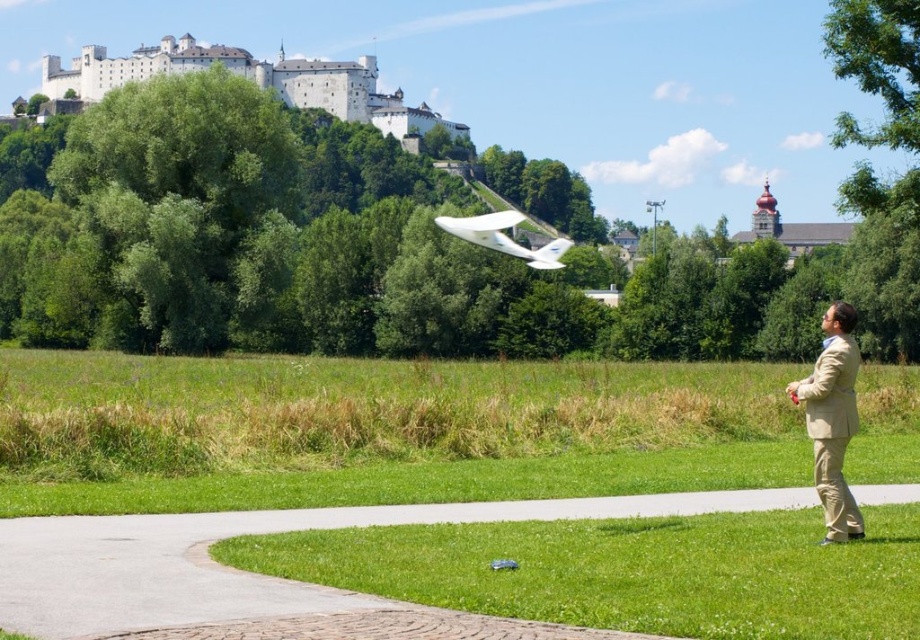
Based on the photo, you are a drone operator who needs to land your drone safely. The green grass at lower right and the white matte glider at center are both visible from your current position. Which location is closer to you as you look towards them?

The green grass at lower right is closer to you because it is in front of the white matte glider at center.

You are a photographer trying to capture a clear shot of the tan fabric suit at right without the green grass at lower right blocking the view. Based on their positions, can you position yourself in a way to avoid the grass blocking the suit?

The tan fabric suit at right is behind the green grass at lower right, so you can move to a position where you can see the suit without the grass blocking it by positioning yourself in front of the grass so that the suit is visible behind it.

You are a drone operator trying to land your drone safely. You see the green grass at lower right and the white matte glider at center. Which area is wider for a safe landing?

The green grass at lower right might be wider than the white matte glider at center, so it could be a safer landing area.